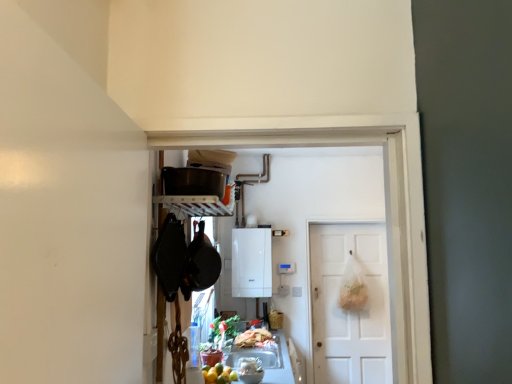
Question: In terms of height, does white matte door at center look taller or shorter compared to matte black pot at upper center?

Choices:
 (A) tall
 (B) short

Answer: (A)

Question: Considering their positions, is white matte door at center located in front of or behind matte black pot at upper center?

Choices:
 (A) front
 (B) behind

Answer: (B)

Question: Which object is positioned closest to the white matte door at center?

Choices:
 (A) white glossy countertop at lower center
 (B) matte black pot at upper center
 (C) shiny plastic bag of food at lower center
 (D) white glossy boiler at center

Answer: (D)

Question: Which is farther from the matte black pot at upper center?

Choices:
 (A) white matte door at center
 (B) shiny plastic bag of food at lower center
 (C) white glossy countertop at lower center
 (D) white glossy boiler at center

Answer: (A)